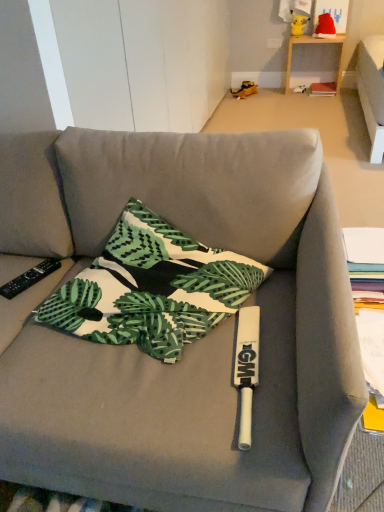
Question: In terms of width, does wooden table at upper right look wider or thinner when compared to yellow plush toy at upper center, marked as the 2th toy in a right-to-left arrangement?

Choices:
 (A) thin
 (B) wide

Answer: (B)

Question: Is point (288, 56) closer or farther from the camera than point (296, 31)?

Choices:
 (A) closer
 (B) farther

Answer: (B)

Question: Which of these objects is positioned farthest from the hardcover book at center?

Choices:
 (A) wooden table at upper right
 (B) red fabric santa hat at upper right, the 2th toy in the left-to-right sequence
 (C) yellow plush toy at upper center, the 1th toy when ordered from left to right
 (D) green leaf-patterned fabric pillow at center
 (E) black plastic remote control at left

Answer: (E)

Question: Estimate the real-world distances between objects in this image. Which object is closer to the hardcover book at center?

Choices:
 (A) wooden table at upper right
 (B) yellow plush toy at upper center, marked as the 2th toy in a right-to-left arrangement
 (C) green leaf-patterned fabric pillow at center
 (D) red fabric santa hat at upper right, the 2th toy in the left-to-right sequence
 (E) black plastic remote control at left

Answer: (A)